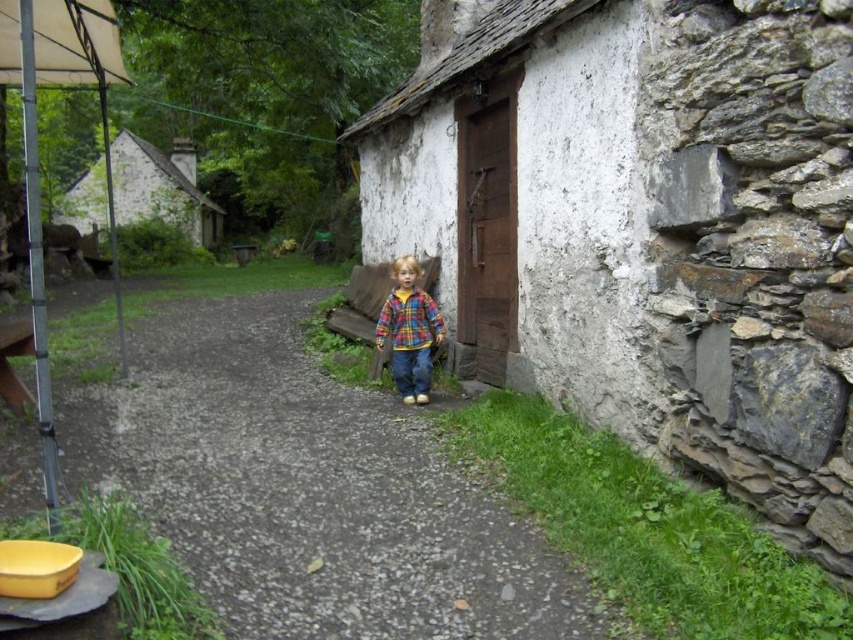
Question: Which of these objects is positioned farthest from the white stone hut at upper left?

Choices:
 (A) plaid fabric shirt at center
 (B) gravel path at center

Answer: (A)

Question: Can you confirm if white plastered wall at center is thinner than plaid fabric shirt at center?

Choices:
 (A) no
 (B) yes

Answer: (A)

Question: Estimate the real-world distances between objects in this image. Which object is farther from the white stone hut at upper left?

Choices:
 (A) gravel path at center
 (B) plaid fabric shirt at center

Answer: (B)

Question: Which object appears closest to the camera in this image?

Choices:
 (A) white stone hut at upper left
 (B) white plastered wall at center
 (C) gravel path at center

Answer: (B)

Question: From the image, what is the correct spatial relationship of gravel path at center in relation to plaid fabric shirt at center?

Choices:
 (A) left
 (B) right

Answer: (A)

Question: Does gravel path at center have a smaller size compared to white stone hut at upper left?

Choices:
 (A) no
 (B) yes

Answer: (B)